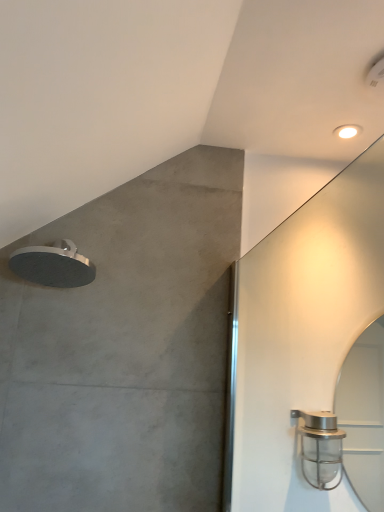
Question: Is satin silver showerhead at upper left, which is the 2th shower in bottom-to-top order, next to satin nickel shower head at right, which is the second shower from top to bottom, and touching it?

Choices:
 (A) no
 (B) yes

Answer: (A)

Question: Would you say satin silver showerhead at upper left, which is the 2th shower in bottom-to-top order, contains satin nickel shower head at right, which is the second shower from top to bottom?

Choices:
 (A) yes
 (B) no

Answer: (B)

Question: Is satin silver showerhead at upper left, placed as the 1th shower when sorted from left to right, bigger than satin nickel shower head at right, which is the 1th shower in right-to-left order?

Choices:
 (A) yes
 (B) no

Answer: (B)

Question: Can you confirm if satin silver showerhead at upper left, which is the second shower from right to left, is thinner than satin nickel shower head at right, which is the second shower from top to bottom?

Choices:
 (A) no
 (B) yes

Answer: (B)

Question: Considering the relative positions of satin silver showerhead at upper left, the 1th shower from the top, and satin nickel shower head at right, the 1th shower positioned from the bottom, in the image provided, is satin silver showerhead at upper left, the 1th shower from the top, to the left of satin nickel shower head at right, the 1th shower positioned from the bottom, from the viewer's perspective?

Choices:
 (A) yes
 (B) no

Answer: (A)

Question: Is point (61, 242) closer or farther from the camera than point (339, 137)?

Choices:
 (A) farther
 (B) closer

Answer: (B)

Question: Is satin silver showerhead at upper left, placed as the 1th shower when sorted from left to right, in front of or behind white glossy droplight at upper right in the image?

Choices:
 (A) front
 (B) behind

Answer: (A)

Question: Considering the positions of satin silver showerhead at upper left, placed as the 1th shower when sorted from left to right, and white glossy droplight at upper right in the image, is satin silver showerhead at upper left, placed as the 1th shower when sorted from left to right, bigger or smaller than white glossy droplight at upper right?

Choices:
 (A) small
 (B) big

Answer: (B)

Question: From the image's perspective, is satin silver showerhead at upper left, the 1th shower from the top, located above or below white glossy droplight at upper right?

Choices:
 (A) below
 (B) above

Answer: (A)

Question: Would you say satin nickel shower head at right, the second shower when ordered from left to right, is inside or outside white glossy droplight at upper right?

Choices:
 (A) inside
 (B) outside

Answer: (B)

Question: From the image's perspective, is satin nickel shower head at right, the second shower when ordered from left to right, located above or below white glossy droplight at upper right?

Choices:
 (A) above
 (B) below

Answer: (B)

Question: Would you say satin nickel shower head at right, which is the second shower from top to bottom, is to the left or to the right of white glossy droplight at upper right in the picture?

Choices:
 (A) left
 (B) right

Answer: (A)

Question: Looking at their shapes, would you say satin nickel shower head at right, the 1th shower positioned from the bottom, is wider or thinner than white glossy droplight at upper right?

Choices:
 (A) thin
 (B) wide

Answer: (B)

Question: Do you think white glossy droplight at upper right is within satin nickel shower head at right, the second shower when ordered from left to right, or outside of it?

Choices:
 (A) outside
 (B) inside

Answer: (A)

Question: Does point (337, 137) appear closer or farther from the camera than point (321, 448)?

Choices:
 (A) farther
 (B) closer

Answer: (A)